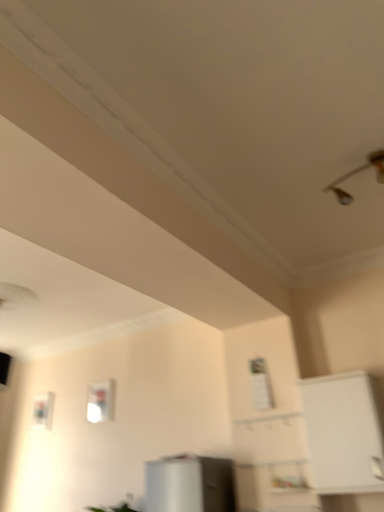
Locate an element on the screen. This screenshot has height=512, width=384. white matte cabinet at right is located at coordinates (343, 433).

From the image's perspective, would you say transparent glass window at center is positioned over metallic silver light fixture at upper right?

No.

Do you think transparent glass window at center is within metallic silver light fixture at upper right, or outside of it?

transparent glass window at center is not enclosed by metallic silver light fixture at upper right.

Is the surface of transparent glass window at center in direct contact with metallic silver light fixture at upper right?

No, transparent glass window at center is not beside metallic silver light fixture at upper right.

Is transparent glass window at center turned away from metallic silver light fixture at upper right?

transparent glass window at center does not have its back to metallic silver light fixture at upper right.

Which object is closer to the camera taking this photo, transparent glass window at center or white matte cabinet at right?

white matte cabinet at right is closer to the camera.

Who is bigger, transparent glass window at center or white matte cabinet at right?

→ Bigger between the two is white matte cabinet at right.

Which of these two, transparent glass window at center or white matte cabinet at right, is thinner?

transparent glass window at center is thinner.

Does point (92, 386) come farther from viewer compared to point (379, 478)?

Yes, point (92, 386) is behind point (379, 478).

From a real-world perspective, which is physically below, white matte cabinet at right or metallic silver light fixture at upper right?

In real-world perspective, white matte cabinet at right is lower.

Is white matte cabinet at right facing away from metallic silver light fixture at upper right?

That's not correct — white matte cabinet at right is not looking away from metallic silver light fixture at upper right.

Considering their positions, is white matte cabinet at right located in front of or behind metallic silver light fixture at upper right?

In the image, white matte cabinet at right appears behind metallic silver light fixture at upper right.

Can you confirm if white matte cabinet at right is thinner than transparent glass window at center?

In fact, white matte cabinet at right might be wider than transparent glass window at center.

Is white matte cabinet at right at the left side of transparent glass window at center?

Incorrect, white matte cabinet at right is not on the left side of transparent glass window at center.

From the image's perspective, is white matte cabinet at right located above or below transparent glass window at center?

Based on their image positions, white matte cabinet at right is located above transparent glass window at center.

In the image, there is a transparent glass window at center. Where is `cabinetry below it (from a real-world perspective)`? The height and width of the screenshot is (512, 384). cabinetry below it (from a real-world perspective) is located at coordinates (343, 433).

Considering the relative sizes of metallic silver light fixture at upper right and transparent glass window at center in the image provided, is metallic silver light fixture at upper right taller than transparent glass window at center?

No, metallic silver light fixture at upper right is not taller than transparent glass window at center.

Can you confirm if metallic silver light fixture at upper right is smaller than transparent glass window at center?

Incorrect, metallic silver light fixture at upper right is not smaller in size than transparent glass window at center.

Is metallic silver light fixture at upper right aimed at transparent glass window at center?

No, metallic silver light fixture at upper right is not turned towards transparent glass window at center.

Consider the image. Is the position of metallic silver light fixture at upper right less distant than that of transparent glass window at center?

That is True.

Considering the relative positions of metallic silver light fixture at upper right and white matte cabinet at right in the image provided, is metallic silver light fixture at upper right to the left or to the right of white matte cabinet at right?

From the image, it's evident that metallic silver light fixture at upper right is to the left of white matte cabinet at right.

From their relative heights in the image, would you say metallic silver light fixture at upper right is taller or shorter than white matte cabinet at right?

Clearly, metallic silver light fixture at upper right is shorter compared to white matte cabinet at right.

Find the location of `cabinetry located behind the metallic silver light fixture at upper right`. cabinetry located behind the metallic silver light fixture at upper right is located at coordinates (343, 433).

Do you think metallic silver light fixture at upper right is within white matte cabinet at right, or outside of it?

metallic silver light fixture at upper right is not enclosed by white matte cabinet at right.

Find the location of a particular element. The width and height of the screenshot is (384, 512). light fixture on the right of transparent glass window at center is located at coordinates (356, 173).

I want to click on cabinetry above the transparent glass window at center (from the image's perspective), so click(343, 433).

Considering their positions, is transparent glass window at center positioned closer to white matte cabinet at right than metallic silver light fixture at upper right?

metallic silver light fixture at upper right is closer to white matte cabinet at right.

From the image, which object appears to be farther from metallic silver light fixture at upper right, transparent glass window at center or white matte cabinet at right?

transparent glass window at center is further to metallic silver light fixture at upper right.

Estimate the real-world distances between objects in this image. Which object is closer to transparent glass window at center, metallic silver light fixture at upper right or white matte cabinet at right?

white matte cabinet at right is closer to transparent glass window at center.

Estimate the real-world distances between objects in this image. Which object is closer to metallic silver light fixture at upper right, white matte cabinet at right or transparent glass window at center?

white matte cabinet at right lies closer to metallic silver light fixture at upper right than the other object.

Based on their spatial positions, is white matte cabinet at right or metallic silver light fixture at upper right closer to transparent glass window at center?

Based on the image, white matte cabinet at right appears to be nearer to transparent glass window at center.

Based on their spatial positions, is metallic silver light fixture at upper right or transparent glass window at center closer to white matte cabinet at right?

metallic silver light fixture at upper right.

This screenshot has height=512, width=384. What are the coordinates of `light fixture between transparent glass window at center and white matte cabinet at right in the horizontal direction` in the screenshot? It's located at (356, 173).